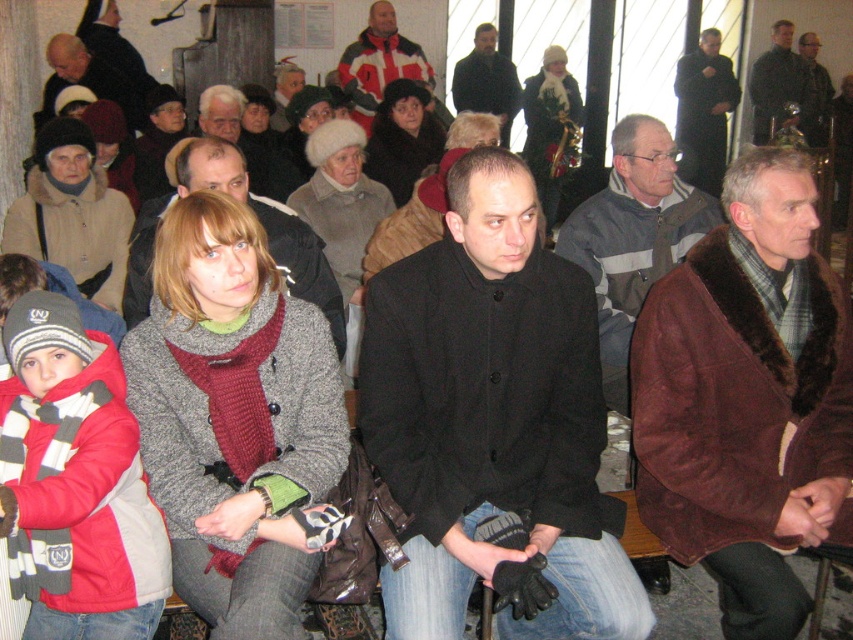
Question: Among these objects, which one is farthest from the camera?

Choices:
 (A) matte black jacket at center
 (B) brown suede coat at right
 (C) camouflage jacket at upper right

Answer: (C)

Question: Which of the following is the farthest from the observer?

Choices:
 (A) brown suede coat at right
 (B) dark gray wool coat at center
 (C) matte black jacket at center

Answer: (B)

Question: Does black woolen coat at center appear on the right side of white and red striped jacket at center?

Choices:
 (A) yes
 (B) no

Answer: (A)

Question: Is black wool coat at upper right positioned before white and red striped jacket at center?

Choices:
 (A) yes
 (B) no

Answer: (B)

Question: Is gray striped sweater at center below dark gray wool coat at center?

Choices:
 (A) no
 (B) yes

Answer: (B)

Question: Which object is closer to the camera taking this photo?

Choices:
 (A) matte black jacket at upper left
 (B) dark gray wool coat at center
 (C) dark gray wool coat at upper right
 (D) brown suede coat at right

Answer: (D)